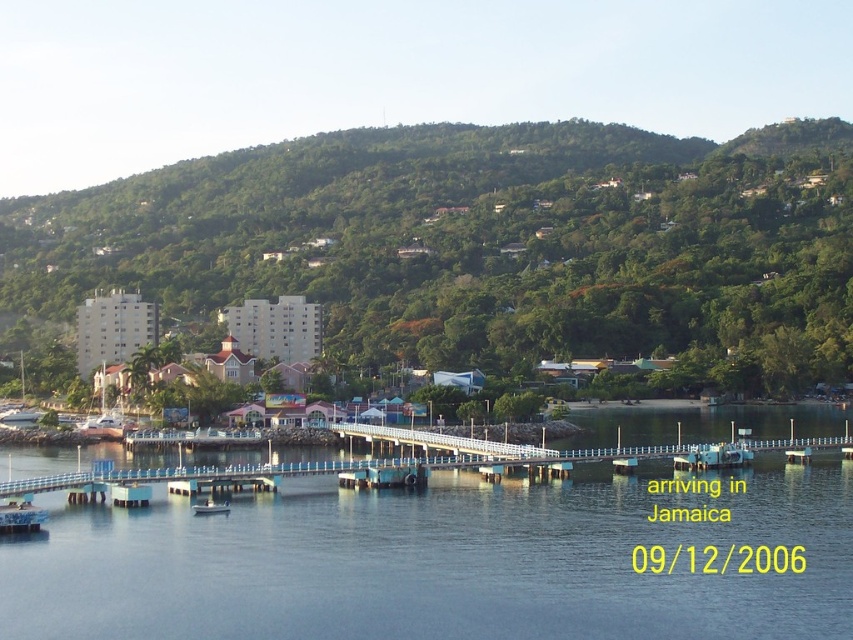
Can you confirm if green leafy hillside at upper center is thinner than white plastic boat at lower center?

No, green leafy hillside at upper center is not thinner than white plastic boat at lower center.

Is point (508, 369) closer to viewer compared to point (212, 497)?

No, it is not.

Where is `green leafy hillside at upper center`? Image resolution: width=853 pixels, height=640 pixels. green leafy hillside at upper center is located at coordinates (476, 241).

Does blue concrete bridge at center have a smaller size compared to white plastic boat at lower center?

No.

Is the position of blue concrete bridge at center more distant than that of white plastic boat at lower center?

No, blue concrete bridge at center is closer to the viewer.

Between point (329, 531) and point (196, 499), which one is positioned behind?

Point (196, 499)

Where is `blue concrete bridge at center`? The width and height of the screenshot is (853, 640). blue concrete bridge at center is located at coordinates (447, 561).

Does green leafy hillside at upper center appear under blue concrete bridge at center?

Incorrect, green leafy hillside at upper center is not positioned below blue concrete bridge at center.

Where is `green leafy hillside at upper center`? green leafy hillside at upper center is located at coordinates (476, 241).

This screenshot has width=853, height=640. In order to click on green leafy hillside at upper center in this screenshot , I will do `click(476, 241)`.